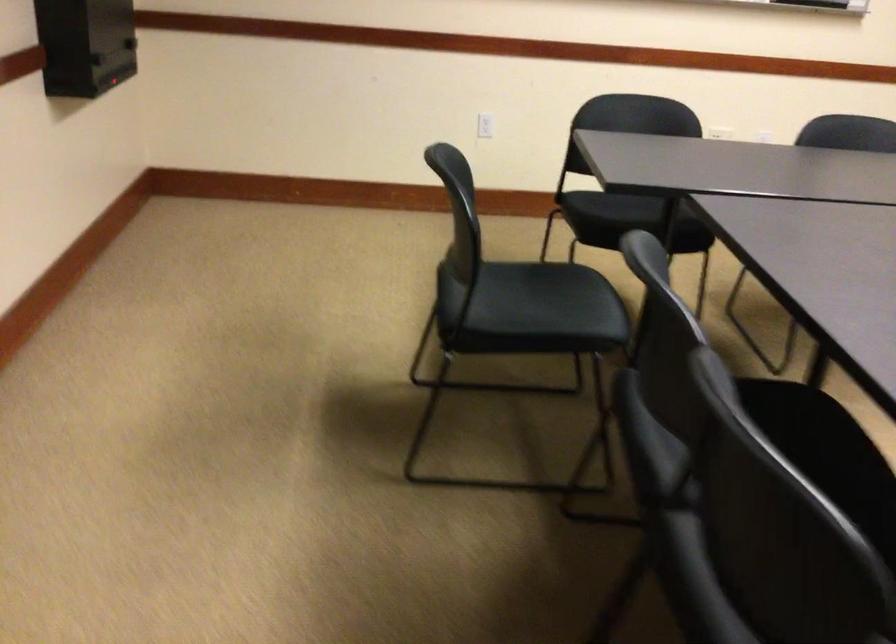
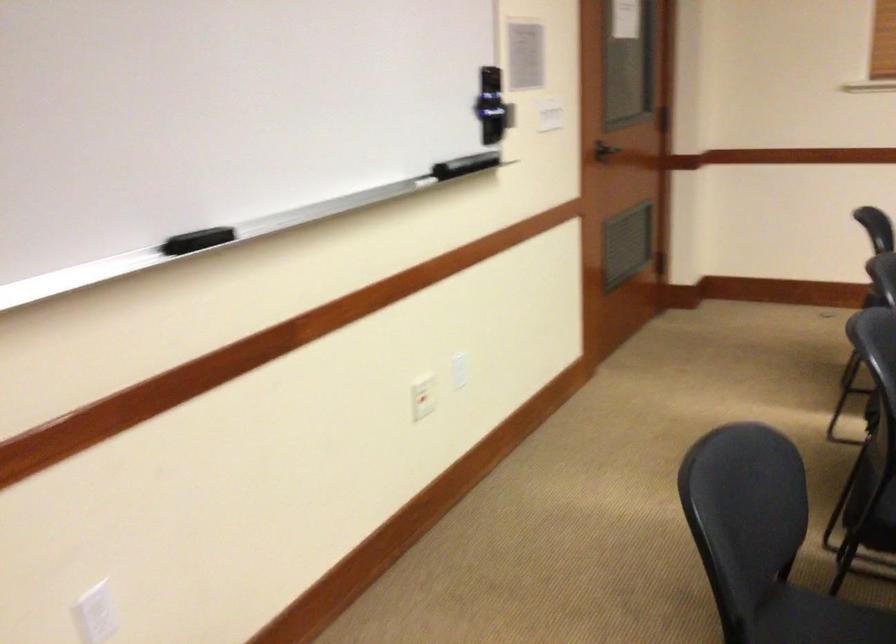
How did the camera likely rotate?

The rotation direction of the camera is right-down.